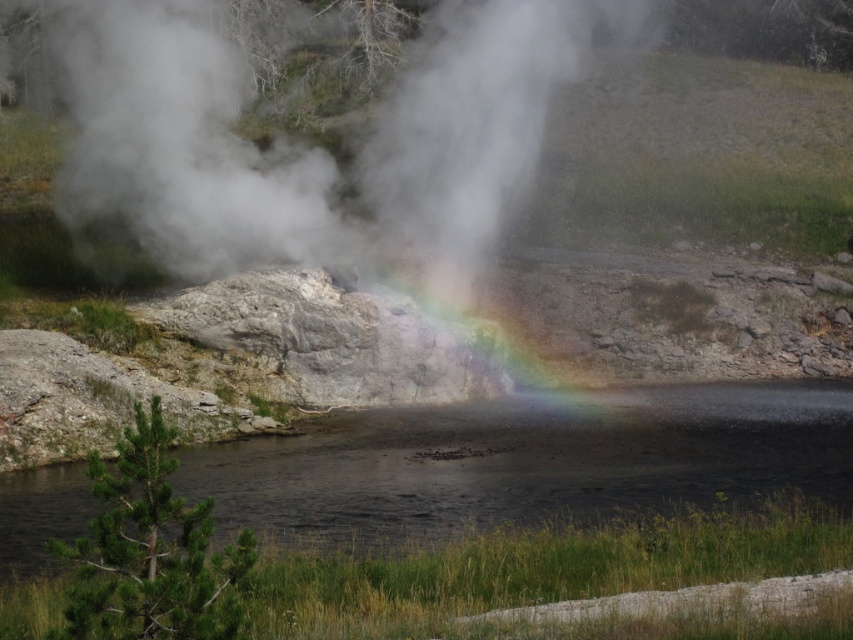
You are standing at the edge of the small dark body of water in the foreground of the geothermal scene. You notice two points marked in the image. Which point is closer to you, point (x=125, y=198) or point (x=607, y=429)?

Point (x=125, y=198) is further to the viewer than point (x=607, y=429). Therefore, point (x=607, y=429) is closer to you.

Consider the image. You are a photographer aiming to capture the white vapor at center and the transparent water at center in a single shot. Given that your camera can only focus on one object at a time, which object should you prioritize focusing on to ensure it appears sharp in the photo?

The white vapor at center is bigger than the transparent water at center, so focusing on the white vapor at center would ensure it appears sharp in the photo.